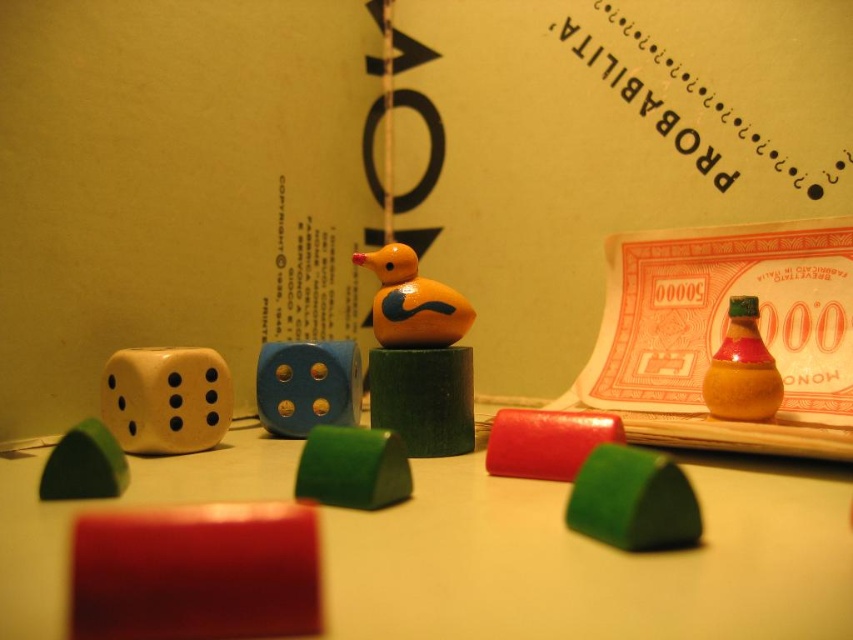
Based on the photo, does wooden blocks at center appear on the left side of yellow matte dice at left?

Incorrect, wooden blocks at center is not on the left side of yellow matte dice at left.

The height and width of the screenshot is (640, 853). Describe the element at coordinates (593, 561) in the screenshot. I see `wooden blocks at center` at that location.

What do you see at coordinates (593, 561) in the screenshot?
I see `wooden blocks at center` at bounding box center [593, 561].

The image size is (853, 640). Identify the location of wooden blocks at center. [593, 561].

Is wooden blocks at center positioned behind smooth red cube at center?

Yes.

Where is `wooden blocks at center`? Image resolution: width=853 pixels, height=640 pixels. wooden blocks at center is located at coordinates (593, 561).

Does point (520, 529) come farther from viewer compared to point (281, 573)?

That is True.

I want to click on wooden blocks at center, so click(x=593, y=561).

Does wooden blocks at center have a smaller size compared to rubberized red block at center?

→ No, wooden blocks at center is not smaller than rubberized red block at center.

Describe the element at coordinates (593, 561) in the screenshot. I see `wooden blocks at center` at that location.

Is point (680, 588) closer to viewer compared to point (491, 454)?

Yes, it is.

Find the location of a particular element. wooden blocks at center is located at coordinates (x=593, y=561).